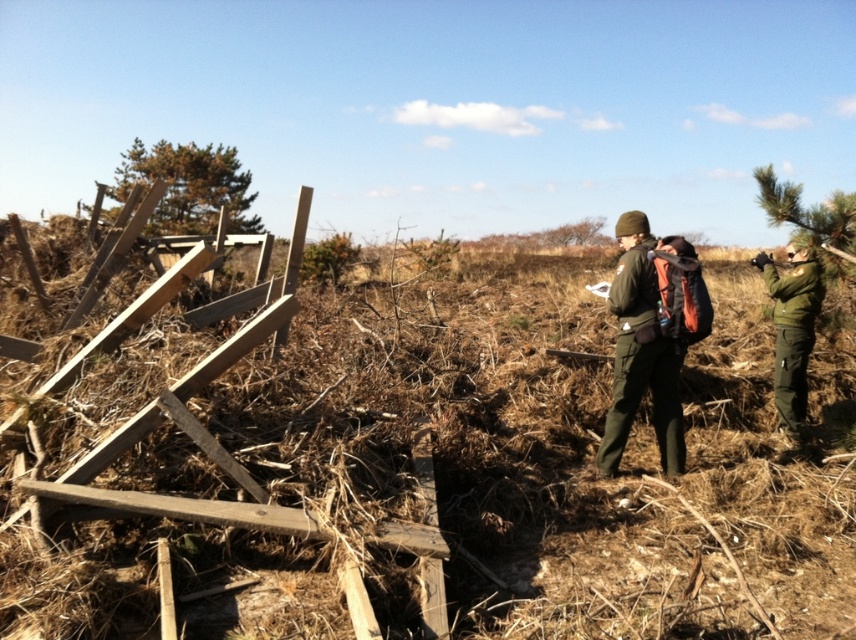
You are a hiker trying to navigate using the trees as landmarks. Which tree, the green leafy tree at upper left or the green textured pine tree at upper right, is positioned higher in the image?

The green leafy tree at upper left is positioned higher in the image than the green textured pine tree at upper right.

You are a hiker trying to take a photo of the green leafy tree at upper left. You are standing near the green matte jacket at right. Which object is wider so you can frame your shot better?

The green leafy tree at upper left is wider than the green matte jacket at right, so you should frame the shot around the tree to capture its width better.

You are a hiker who spots the green matte uniform at center and the green leafy tree at upper left in the distance. Which object is positioned to the right of the other?

The green matte uniform at center is to the right of the green leafy tree at upper left.